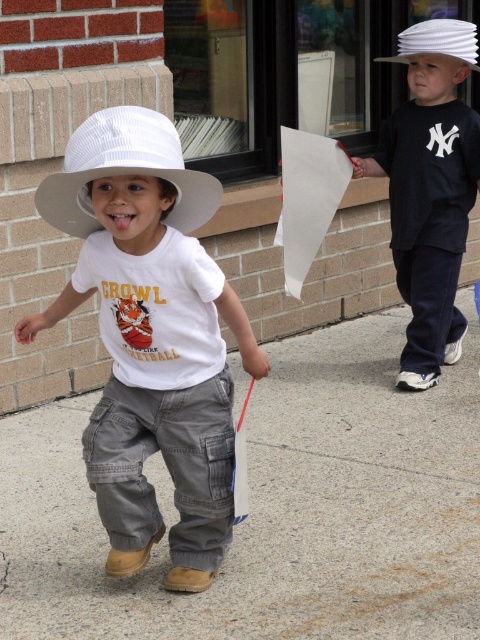
Question: Does gray concrete pavement at center have a smaller size compared to white straw hat at left?

Choices:
 (A) no
 (B) yes

Answer: (A)

Question: Among these points, which one is farthest from the camera?

Choices:
 (A) (372, 541)
 (B) (169, 136)
 (C) (421, 29)

Answer: (C)

Question: Can you confirm if white matte hat at upper right is positioned to the right of white fabric cowboy hat at upper center?

Choices:
 (A) yes
 (B) no

Answer: (A)

Question: Can you confirm if gray concrete pavement at center is bigger than matte white hat at left?

Choices:
 (A) yes
 (B) no

Answer: (A)

Question: Among these points, which one is farthest from the camera?

Choices:
 (A) (78, 129)
 (B) (415, 157)
 (C) (122, 120)
 (D) (460, 44)

Answer: (B)

Question: Which point is closer to the camera taking this photo?

Choices:
 (A) 113,436
 (B) 444,216
 (C) 144,115

Answer: (C)